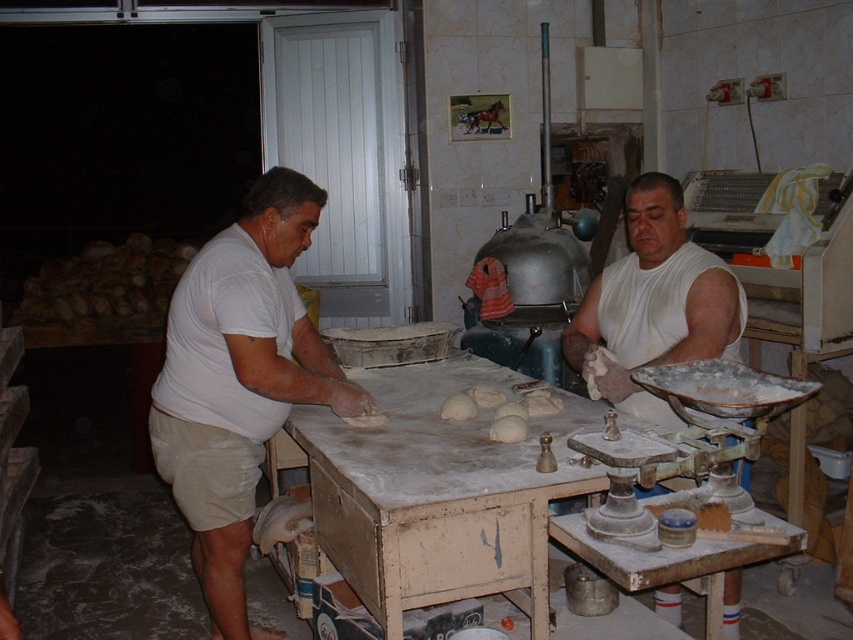
From the picture: Is white wooden table at center to the right of white matte shirt at center from the viewer's perspective?

In fact, white wooden table at center is to the left of white matte shirt at center.

Which is above, white wooden table at center or white matte shirt at center?

white matte shirt at center is above.

Find the location of a particular element. This screenshot has width=853, height=640. white wooden table at center is located at coordinates (438, 493).

Locate an element on the screen. Image resolution: width=853 pixels, height=640 pixels. white wooden table at center is located at coordinates (438, 493).

Does white matte shirt at left have a larger size compared to white matte shirt at center?

Yes, white matte shirt at left is bigger than white matte shirt at center.

What do you see at coordinates (239, 380) in the screenshot?
I see `white matte shirt at left` at bounding box center [239, 380].

Find the location of a particular element. white matte shirt at left is located at coordinates (239, 380).

Which is in front, point (537, 563) or point (163, 436)?

Point (537, 563)

Can you confirm if white wooden table at center is smaller than white matte shirt at left?

No.

Does point (364, 452) lie in front of point (155, 397)?

Yes.

Find the location of a particular element. Image resolution: width=853 pixels, height=640 pixels. white wooden table at center is located at coordinates (438, 493).